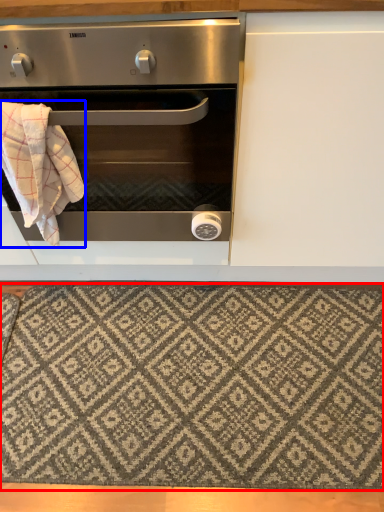
Question: Which object appears closest to the camera in this image, mat (highlighted by a red box) or blanket (highlighted by a blue box)?

Choices:
 (A) mat
 (B) blanket

Answer: (B)